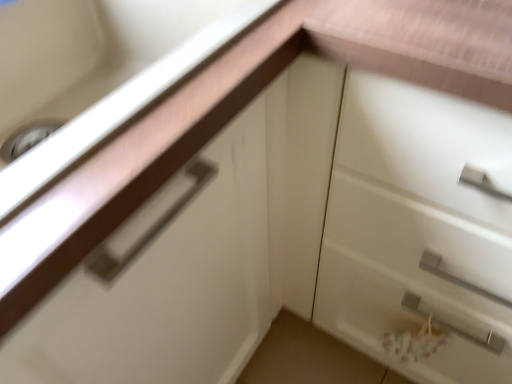
The height and width of the screenshot is (384, 512). Describe the element at coordinates (165, 281) in the screenshot. I see `matte white cabinet at upper left` at that location.

Locate an element on the screen. This screenshot has height=384, width=512. matte white cabinet at upper left is located at coordinates (165, 281).

Measure the distance between matte white cabinet at upper left and camera.

They are 11.35 inches apart.

This screenshot has width=512, height=384. In order to click on matte white cabinet at upper left in this screenshot , I will do `click(165, 281)`.